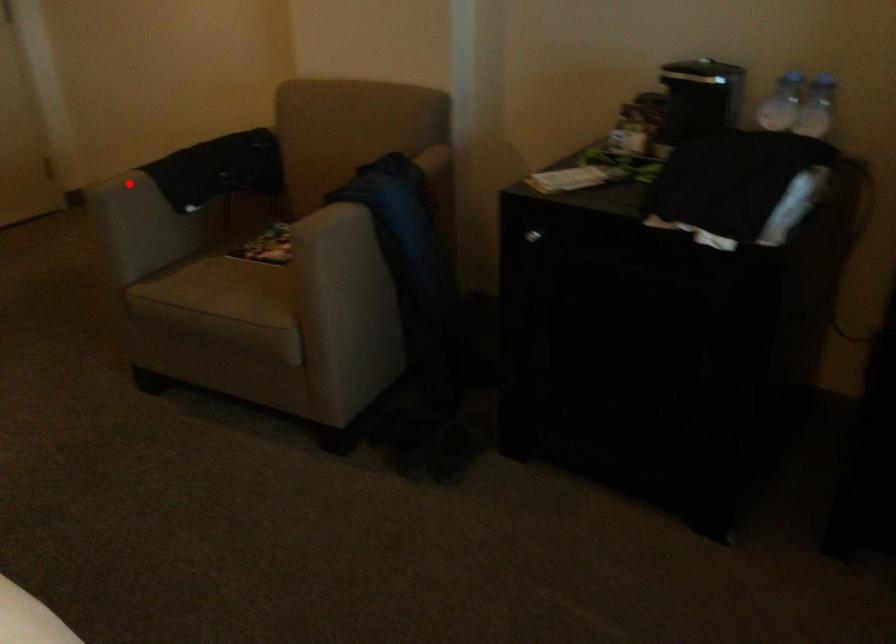
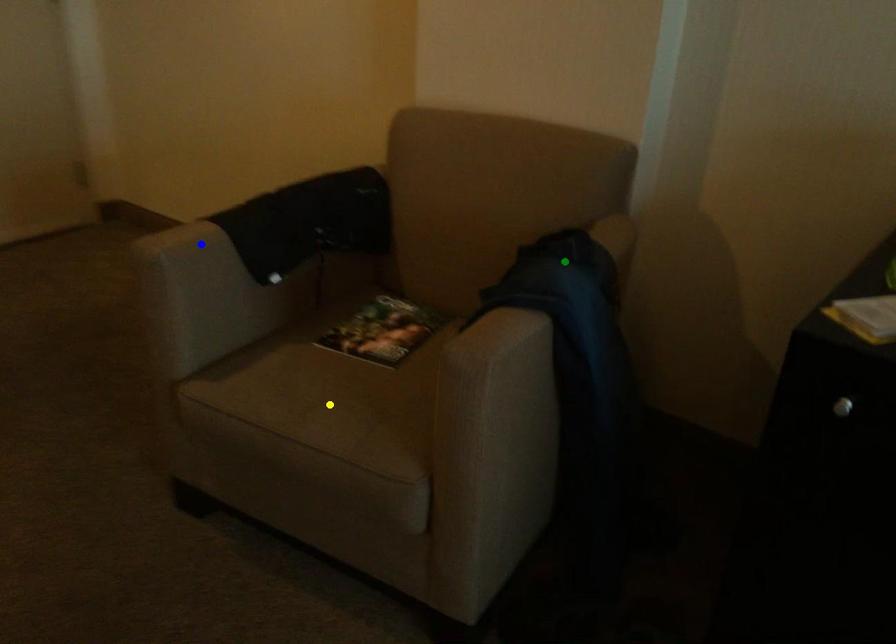
Question: I am providing you with two images of the same scene from different viewpoints. A red point is marked on the first image. You are given multiple points on the second image. Can you choose the point in image 2 that corresponds to the point in image 1?

Choices:
 (A) yellow point
 (B) green point
 (C) blue point

Answer: (C)